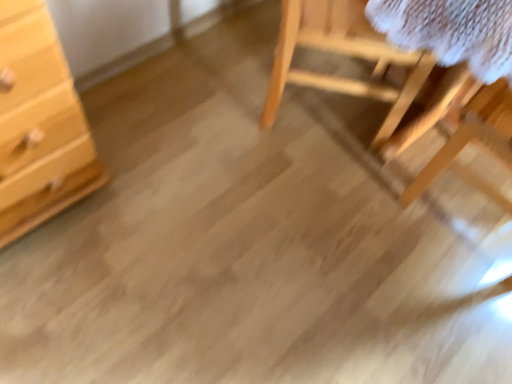
This screenshot has height=384, width=512. I want to click on unoccupied space behind light wood chest of drawers at left, so [x=126, y=107].